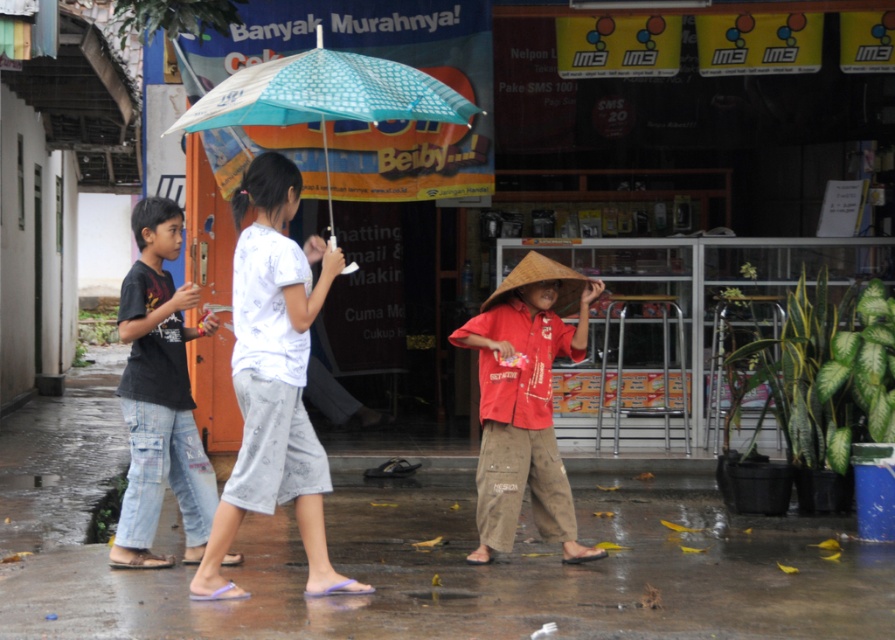
Can you confirm if wet concrete pavement at lower center is positioned to the right of teal printed fabric umbrella at upper center?

Indeed, wet concrete pavement at lower center is positioned on the right side of teal printed fabric umbrella at upper center.

Is wet concrete pavement at lower center in front of teal printed fabric umbrella at upper center?

No, wet concrete pavement at lower center is behind teal printed fabric umbrella at upper center.

Is point (735, 524) farther from camera compared to point (348, 106)?

Yes.

You are a GUI agent. You are given a task and a screenshot of the screen. Output one action in this format:
    pyautogui.click(x=<x>, y=<y>)
    Task: Click on the wet concrete pavement at lower center
    The width and height of the screenshot is (895, 640).
    Given the screenshot: What is the action you would take?
    pyautogui.click(x=493, y=572)

Is point (312, 497) positioned after point (308, 92)?

Yes, point (312, 497) is farther from viewer.

Is the position of white cotton shirt at center more distant than that of teal printed fabric umbrella at upper center?

No, it is in front of teal printed fabric umbrella at upper center.

Describe the element at coordinates (274, 380) in the screenshot. I see `white cotton shirt at center` at that location.

Locate an element on the screen. white cotton shirt at center is located at coordinates (274, 380).

Locate an element on the screen. white cotton shirt at center is located at coordinates (274, 380).

Is white cotton shirt at center to the left of dark blue jeans at left from the viewer's perspective?

No, white cotton shirt at center is not to the left of dark blue jeans at left.

Which is in front, point (249, 248) or point (149, 285)?

Positioned in front is point (249, 248).

This screenshot has width=895, height=640. What are the coordinates of `white cotton shirt at center` in the screenshot? It's located at (274, 380).